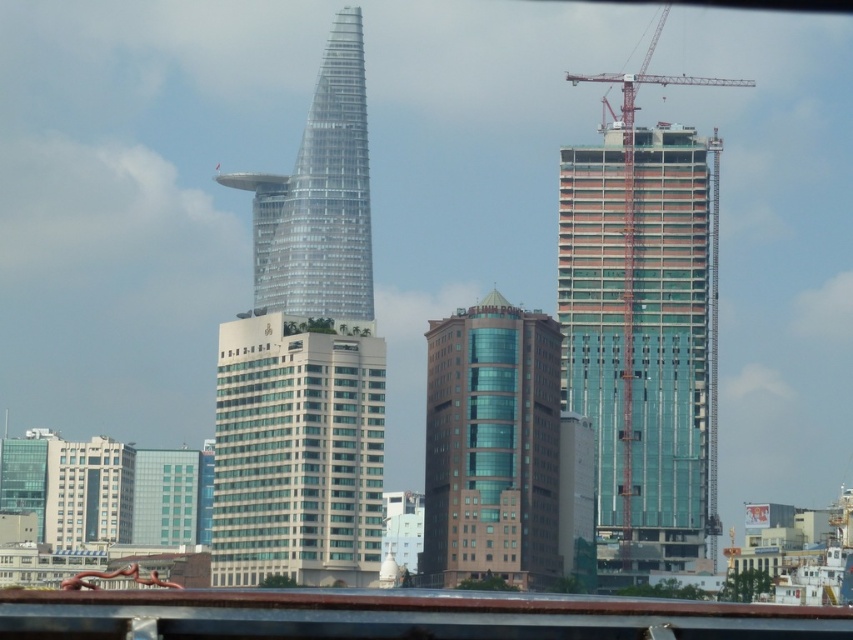
Which is in front, point (329, 545) or point (500, 396)?

Point (329, 545) is more forward.

Between white glass building at center and brown glass building at center, which one has more height?

brown glass building at center

Does point (373, 552) come in front of point (427, 579)?

Yes, point (373, 552) is closer to viewer.

In order to click on white glass building at center in this screenshot , I will do 297,451.

Who is taller, brown glass building at center or metallic construction crane at right?

metallic construction crane at right is taller.

Can you confirm if brown glass building at center is smaller than metallic construction crane at right?

Yes.

Find the location of a particular element. The height and width of the screenshot is (640, 853). brown glass building at center is located at coordinates (492, 445).

Who is positioned more to the right, white glass building at center or transparent glass skyscraper at center?

Positioned to the right is transparent glass skyscraper at center.

Which of these two, white glass building at center or transparent glass skyscraper at center, stands taller?

With more height is transparent glass skyscraper at center.

Is point (289, 385) positioned behind point (305, 241)?

No, (289, 385) is in front of (305, 241).

What are the coordinates of `white glass building at center` in the screenshot? It's located at (297, 451).